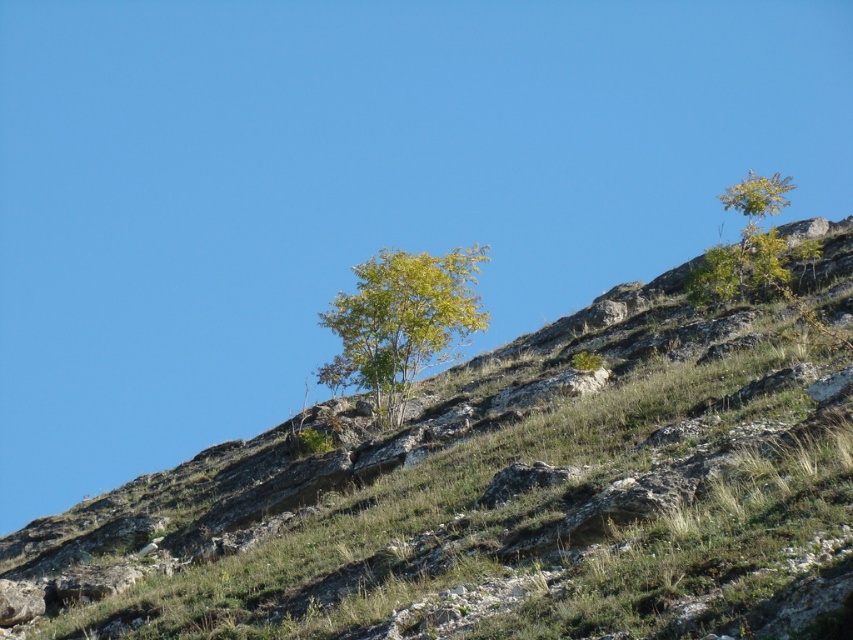
You are standing at the base of the hillside and want to reach the point marked as point (773, 230). There is another point, point (548, 392), along the way. Based on the terrain described, which point will you encounter first while moving towards your destination?

You will encounter point (548, 392) first because it is in front of point (773, 230) along the path to the destination.

You are planning to plant a new tree on the green grassy hillside at upper center. Considering the size of the hillside and the existing green leafy tree at upper right, will there be enough space for the new tree?

The green grassy hillside at upper center has a smaller size compared to green leafy tree at upper right. Therefore, there may not be sufficient space to plant a new tree there without encroaching on the existing tree or the limited area of the hillside.